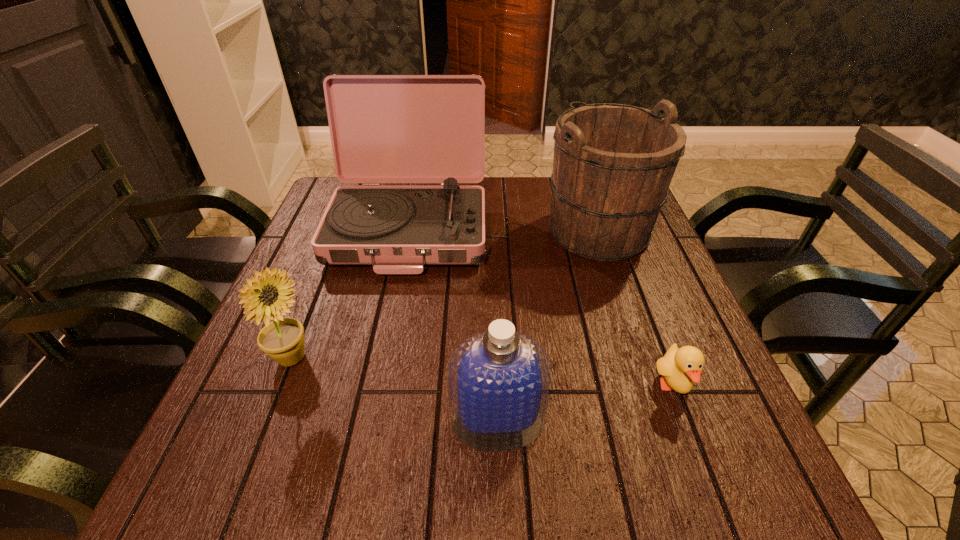
Where is `record player that is at the far edge`? This screenshot has height=540, width=960. record player that is at the far edge is located at coordinates (384, 128).

Locate an element on the screen. The height and width of the screenshot is (540, 960). bucket located in the far edge section of the desktop is located at coordinates (613, 163).

Find the location of a particular element. object positioned at the near edge is located at coordinates (499, 381).

Find the location of a particular element. The height and width of the screenshot is (540, 960). record player located at the left edge is located at coordinates (384, 128).

I want to click on sunflower present at the left edge, so click(282, 339).

Where is `bucket that is at the right edge`? bucket that is at the right edge is located at coordinates [x=613, y=163].

The width and height of the screenshot is (960, 540). I want to click on duckling that is at the right edge, so click(680, 368).

This screenshot has height=540, width=960. I want to click on object present at the far left corner, so click(384, 128).

Locate an element on the screen. object positioned at the far right corner is located at coordinates (613, 163).

You are a GUI agent. You are given a task and a screenshot of the screen. Output one action in this format:
    pyautogui.click(x=<x>, y=<y>)
    Task: Click on the free space at the near edge
    
    Given the screenshot: What is the action you would take?
    pyautogui.click(x=339, y=469)